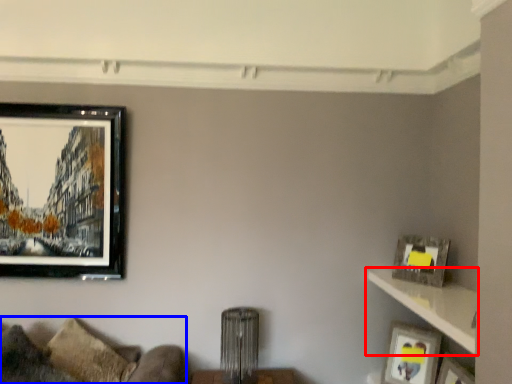
Question: Among these objects, which one is nearest to the camera, shelf (highlighted by a red box) or couch (highlighted by a blue box)?

Choices:
 (A) shelf
 (B) couch

Answer: (A)